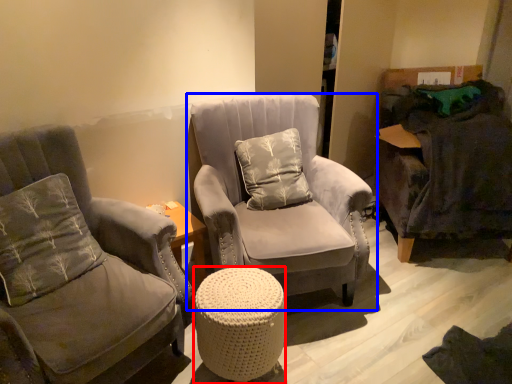
Question: Which point is closer to the camera, table (highlighted by a red box) or chair (highlighted by a blue box)?

Choices:
 (A) table
 (B) chair

Answer: (A)